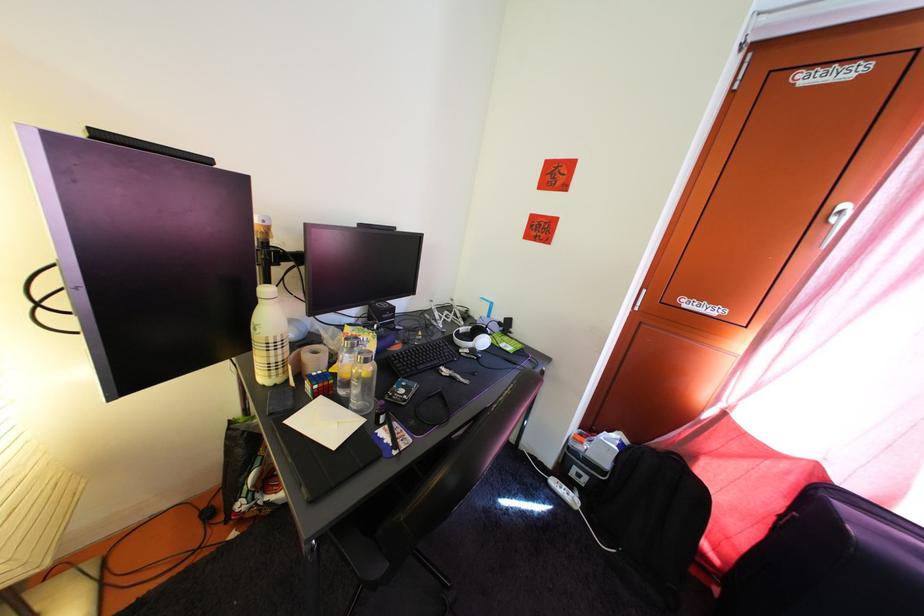
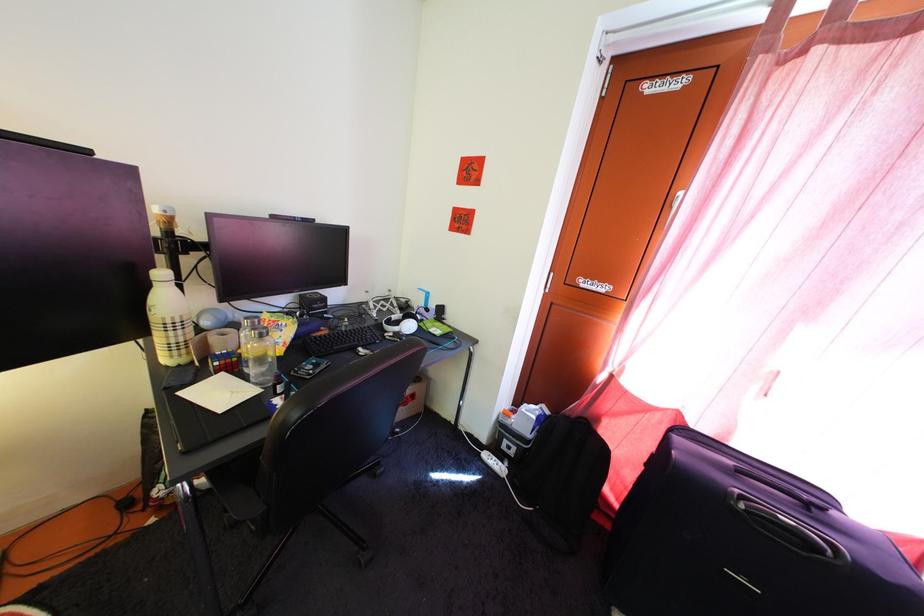
Locate, in the second image, the point that corresponds to pixel 281 361 in the first image.

(179, 341)